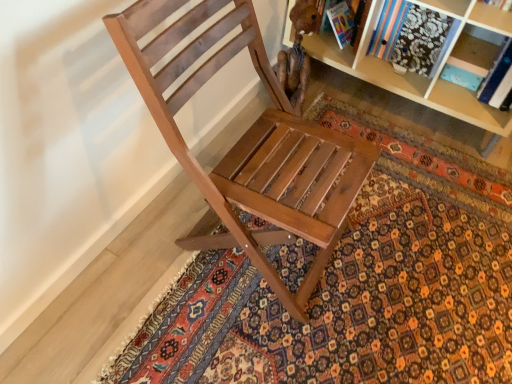
Question: Is wooden chair at center wider or thinner than patterned carpet at center?

Choices:
 (A) thin
 (B) wide

Answer: (A)

Question: Is wooden chair at center in front of or behind patterned carpet at center in the image?

Choices:
 (A) front
 (B) behind

Answer: (A)

Question: Considering the positions of wooden chair at center and patterned carpet at center in the image, is wooden chair at center taller or shorter than patterned carpet at center?

Choices:
 (A) tall
 (B) short

Answer: (A)

Question: Is patterned carpet at center in front of or behind wooden chair at center in the image?

Choices:
 (A) front
 (B) behind

Answer: (B)

Question: Visually, is patterned carpet at center positioned to the left or to the right of wooden chair at center?

Choices:
 (A) right
 (B) left

Answer: (A)

Question: From the image's perspective, is patterned carpet at center located above or below wooden chair at center?

Choices:
 (A) above
 (B) below

Answer: (B)

Question: Considering the positions of patterned carpet at center and wooden chair at center in the image, is patterned carpet at center wider or thinner than wooden chair at center?

Choices:
 (A) wide
 (B) thin

Answer: (A)